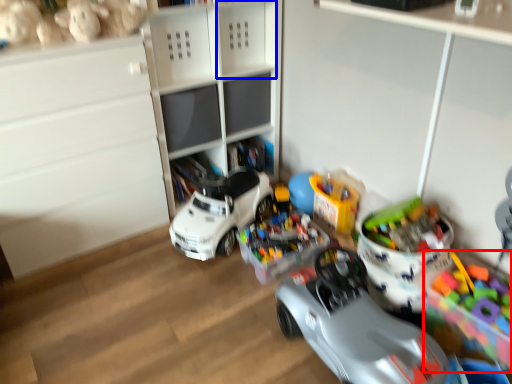
Question: Among these objects, which one is farthest to the camera, toy (highlighted by a red box) or shelf (highlighted by a blue box)?

Choices:
 (A) toy
 (B) shelf

Answer: (B)